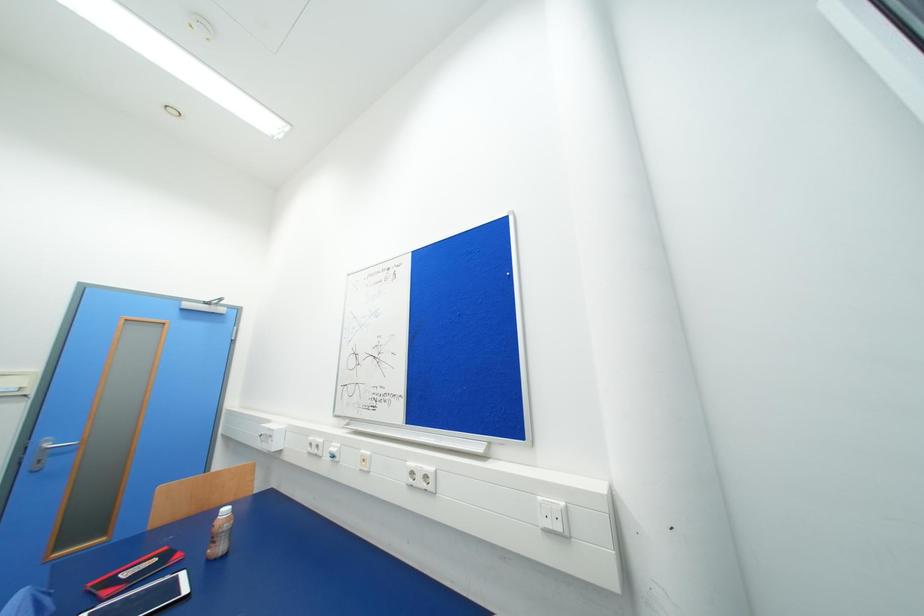
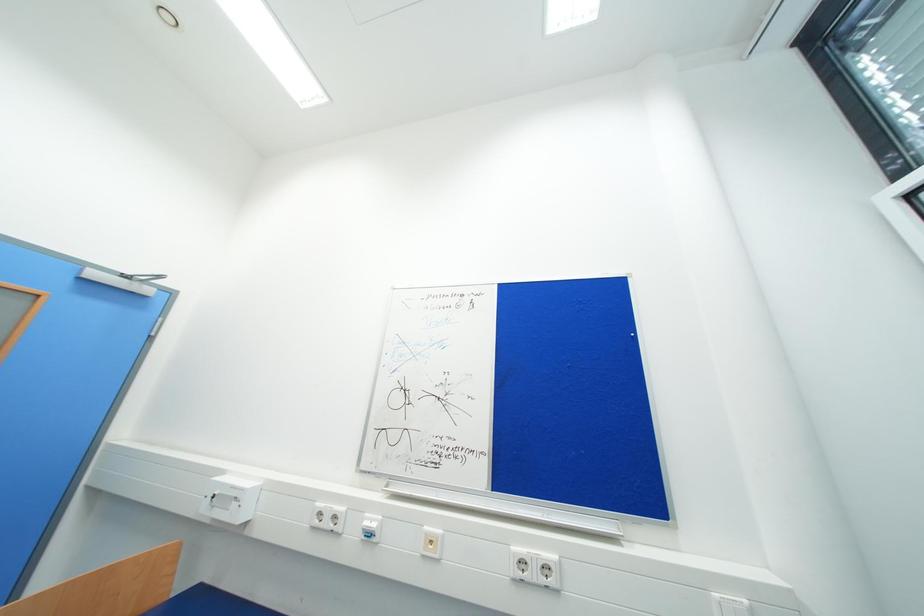
Question: The first image is from the beginning of the video and the second image is from the end. How did the camera likely rotate when shooting the video?

Choices:
 (A) Left
 (B) Right
 (C) Up
 (D) Down

Answer: (B)